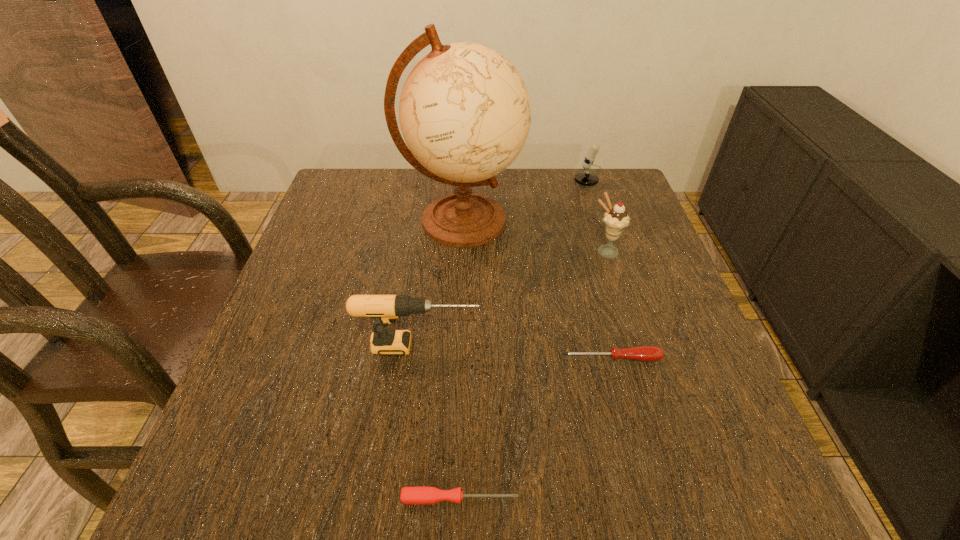
The image size is (960, 540). I want to click on object that is at the far right corner, so click(586, 178).

Image resolution: width=960 pixels, height=540 pixels. In the image, there is a desktop. In order to click on vacant area at the far edge in this screenshot , I will do `click(543, 200)`.

Identify the location of vacant space at the near edge of the desktop. (521, 458).

You are a GUI agent. You are given a task and a screenshot of the screen. Output one action in this format:
    pyautogui.click(x=<x>, y=<y>)
    Task: Click on the vacant space at the left edge of the desktop
    
    Given the screenshot: What is the action you would take?
    click(x=346, y=223)

In the image, there is a desktop. Where is `vacant area at the right edge`? vacant area at the right edge is located at coordinates (653, 372).

The height and width of the screenshot is (540, 960). In the image, there is a desktop. Find the location of `free space at the near left corner`. free space at the near left corner is located at coordinates (244, 481).

The image size is (960, 540). What are the coordinates of `vacant space at the far right corner of the desktop` in the screenshot? It's located at (583, 198).

The width and height of the screenshot is (960, 540). I want to click on empty space between the globe and the left screwdriver, so click(x=461, y=360).

Where is `vacant space that's between the icecream and the globe`? The image size is (960, 540). vacant space that's between the icecream and the globe is located at coordinates (534, 237).

I want to click on free point between the drill and the right screwdriver, so click(516, 352).